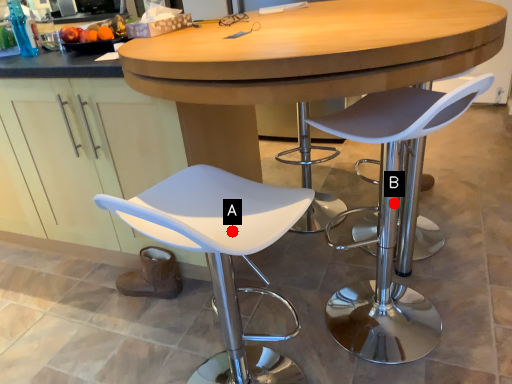
Question: Two points are circled on the image, labeled by A and B beside each circle. Which point appears farthest from the camera in this image?

Choices:
 (A) A is further
 (B) B is further

Answer: (B)